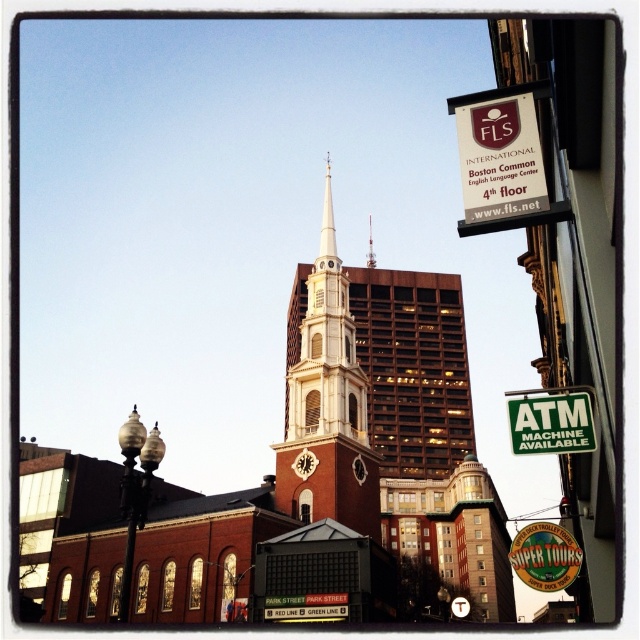
Question: Is brown brick church at center behind green plastic atm machine available sign at upper right?

Choices:
 (A) no
 (B) yes

Answer: (B)

Question: Which point is closer to the camera?

Choices:
 (A) green wooden sign at lower right
 (B) silver metallic spire at center
 (C) white stone clock tower at center
 (D) white steeple at center

Answer: (A)

Question: Which point appears farthest from the camera in this image?

Choices:
 (A) (563, 529)
 (B) (244, 541)
 (C) (369, 234)
 (D) (289, 397)

Answer: (C)

Question: Observing the image, what is the correct spatial positioning of brown brick church at center in reference to green wooden sign at lower right?

Choices:
 (A) right
 (B) left

Answer: (B)

Question: Which object is the farthest from the silver metallic spire at center?

Choices:
 (A) green plastic atm machine available sign at upper right
 (B) green wooden sign at lower right

Answer: (A)

Question: Can you confirm if green plastic atm machine available sign at upper right is smaller than silver metallic spire at center?

Choices:
 (A) no
 (B) yes

Answer: (B)